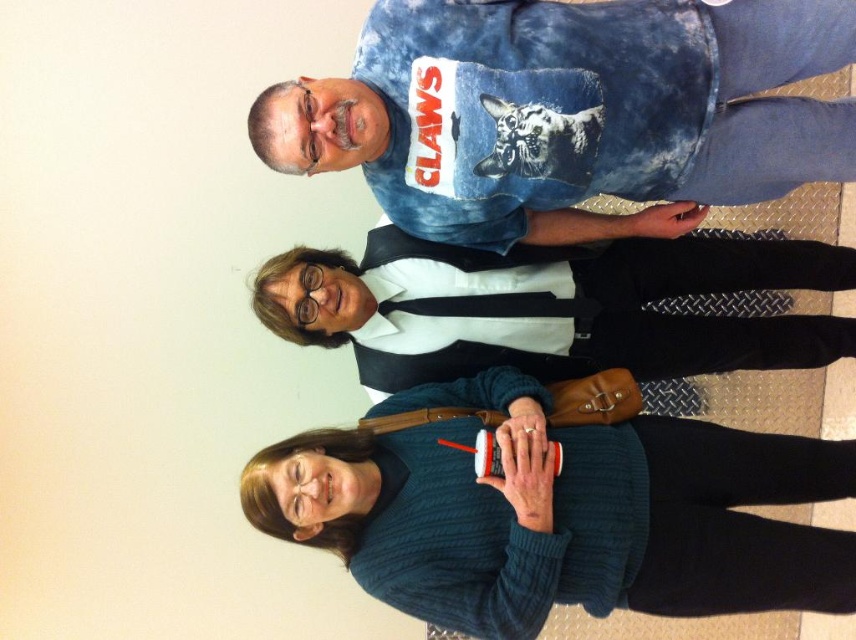
Question: Is tie-dye cotton shirt at upper center smaller than denim shirt at center?

Choices:
 (A) no
 (B) yes

Answer: (B)

Question: In this image, where is dark blue knitted sweater at center located relative to denim shirt at center?

Choices:
 (A) right
 (B) left

Answer: (B)

Question: Based on their relative distances, which object is nearer to the tie-dye cotton shirt at upper center?

Choices:
 (A) dark blue knitted sweater at center
 (B) denim shirt at center

Answer: (B)

Question: Which point is closer to the camera?

Choices:
 (A) tie-dye cotton shirt at upper center
 (B) denim shirt at center
 (C) dark blue knitted sweater at center

Answer: (A)

Question: In this image, where is tie-dye cotton shirt at upper center located relative to dark blue knitted sweater at center?

Choices:
 (A) below
 (B) above

Answer: (B)

Question: Which point is closer to the camera taking this photo?

Choices:
 (A) (670, 484)
 (B) (474, 148)

Answer: (B)